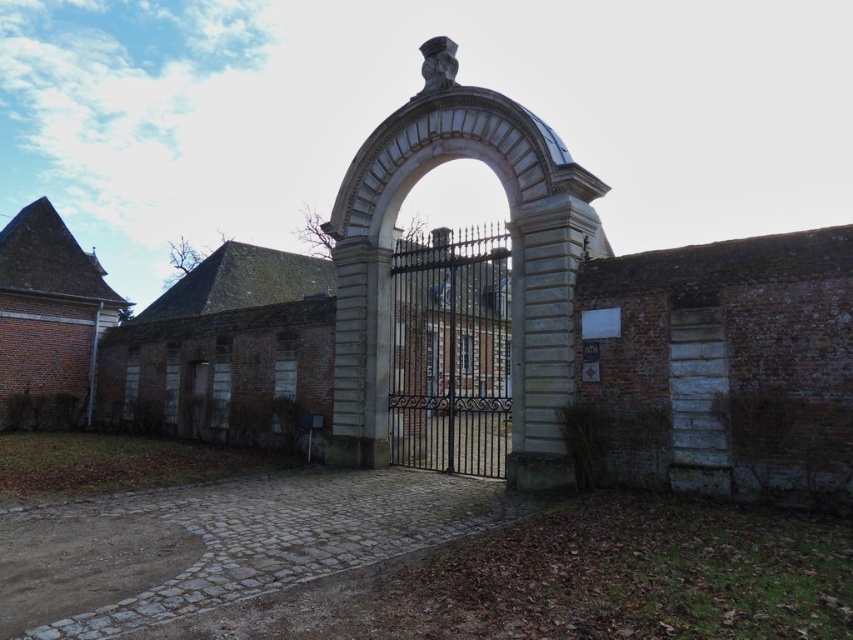
Question: Estimate the real-world distances between objects in this image. Which object is farther from the brown wooden door at center?

Choices:
 (A) black wrought iron gate at center
 (B) white stone archway at center

Answer: (A)

Question: Is white stone archway at center bigger than black wrought iron gate at center?

Choices:
 (A) yes
 (B) no

Answer: (B)

Question: Does white stone archway at center appear under brown wooden door at center?

Choices:
 (A) yes
 (B) no

Answer: (B)

Question: Can you confirm if black wrought iron gate at center is positioned below brown wooden door at center?

Choices:
 (A) no
 (B) yes

Answer: (A)

Question: Which point appears farthest from the camera in this image?

Choices:
 (A) (386, 193)
 (B) (190, 372)
 (C) (401, 346)

Answer: (B)

Question: Which point is closer to the camera taking this photo?

Choices:
 (A) (334, 419)
 (B) (497, 252)
 (C) (192, 428)

Answer: (B)